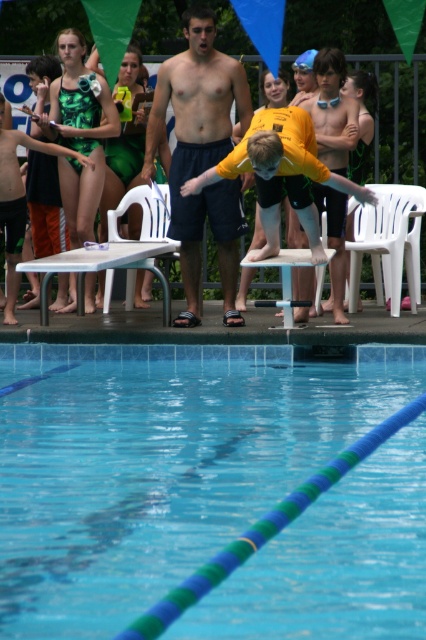
Question: Which of the following is the farthest from the observer?

Choices:
 (A) yellow matte swimsuit at center
 (B) yellow matte shirt at center

Answer: (A)

Question: Considering the relative positions of blue smooth water at center and dark blue shorts at center in the image provided, where is blue smooth water at center located with respect to dark blue shorts at center?

Choices:
 (A) right
 (B) left

Answer: (A)

Question: Among these points, which one is farthest from the camera?

Choices:
 (A) (262, 198)
 (B) (8, 284)

Answer: (B)

Question: Which of the following is the farthest from the observer?

Choices:
 (A) blue smooth water at center
 (B) dark blue shorts at center
 (C) yellow matte swimsuit at center
 (D) green textured swimsuit at left

Answer: (D)

Question: In this image, where is yellow matte swimsuit at center located relative to green textured swimsuit at left?

Choices:
 (A) below
 (B) above

Answer: (B)

Question: Considering the relative positions of blue smooth water at center and dark blue shorts at center in the image provided, where is blue smooth water at center located with respect to dark blue shorts at center?

Choices:
 (A) right
 (B) left

Answer: (A)